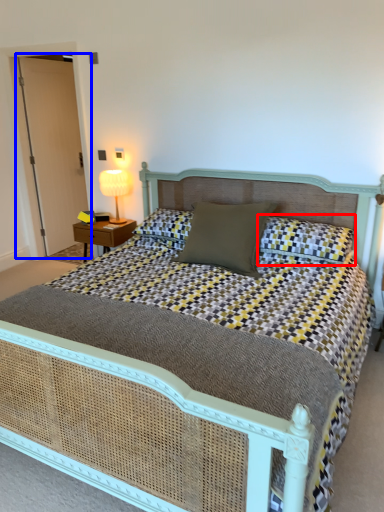
Question: Which of the following is the farthest to the observer, pillow (highlighted by a red box) or glass door (highlighted by a blue box)?

Choices:
 (A) pillow
 (B) glass door

Answer: (B)